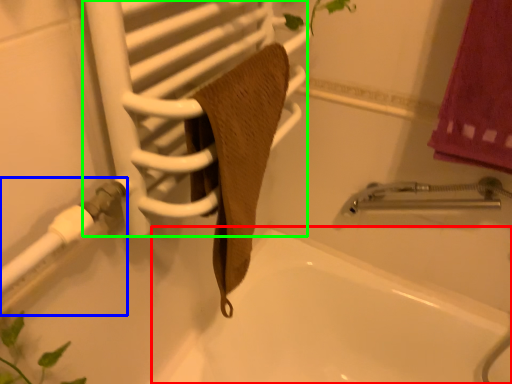
Question: Which object is positioned farthest from bath (highlighted by a red box)? Select from shower (highlighted by a blue box) and screen door (highlighted by a green box).

Choices:
 (A) shower
 (B) screen door

Answer: (A)